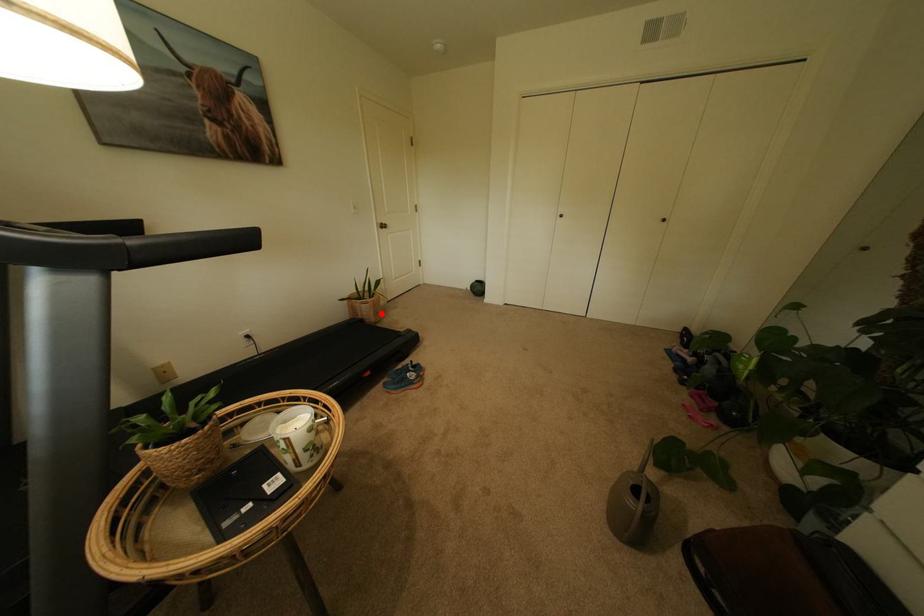
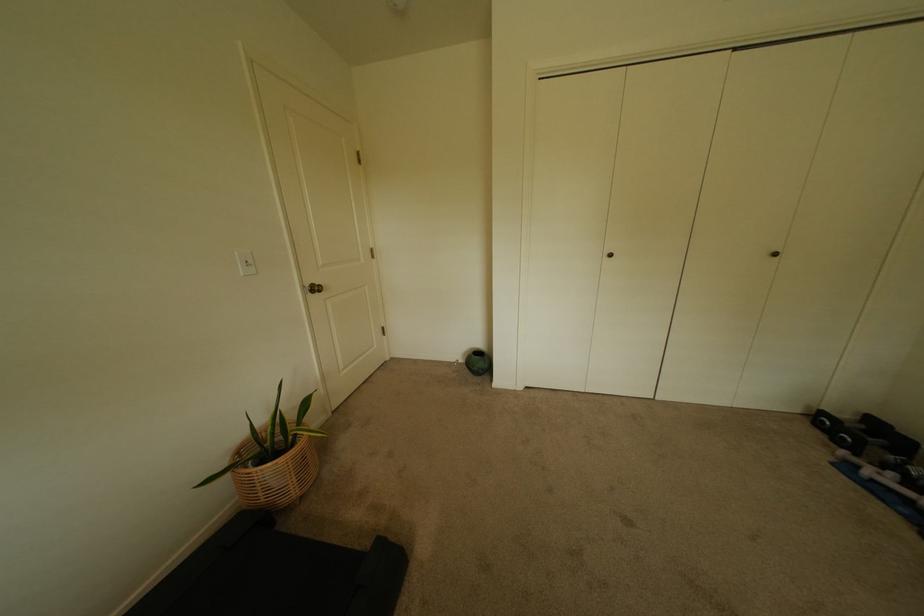
Question: I am providing you with two images of the same scene from different viewpoints. A red point is marked on the first image. At the location where the point appears in image 1, is it still visible in image 2?

Choices:
 (A) Yes
 (B) No

Answer: (A)